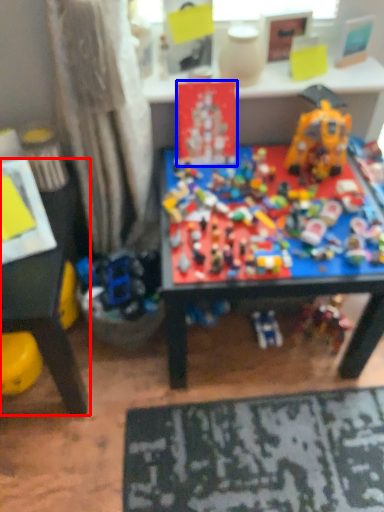
Question: Among these objects, which one is nearest to the camera, table (highlighted by a red box) or toy (highlighted by a blue box)?

Choices:
 (A) table
 (B) toy

Answer: (A)